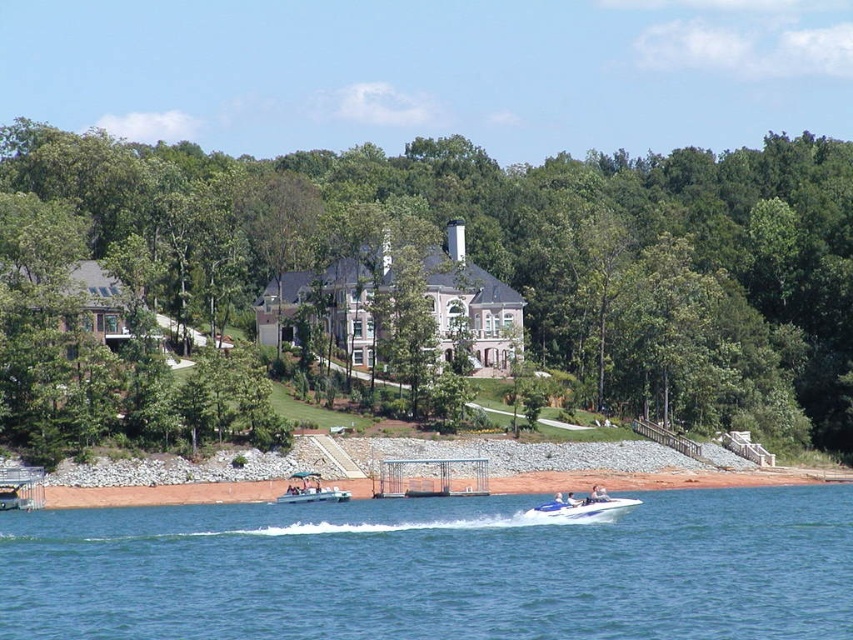
Question: Among these points, which one is farthest from the camera?

Choices:
 (A) (550, 506)
 (B) (775, 160)
 (C) (294, 484)
 (D) (228, 611)

Answer: (B)

Question: Does green leafy tree at center lie behind blue water at lower center?

Choices:
 (A) yes
 (B) no

Answer: (A)

Question: Considering the real-world distances, which object is farthest from the blue water at lower center?

Choices:
 (A) blue metallic speedboat at lower center
 (B) green leafy tree at center

Answer: (B)

Question: Can you confirm if green leafy tree at center is thinner than blue metallic speedboat at lower center?

Choices:
 (A) yes
 (B) no

Answer: (B)

Question: Which point is farther from the camera taking this photo?

Choices:
 (A) (640, 556)
 (B) (300, 500)
 (C) (556, 509)

Answer: (B)

Question: Does blue water at lower center appear under blue metallic speedboat at lower center?

Choices:
 (A) yes
 (B) no

Answer: (A)